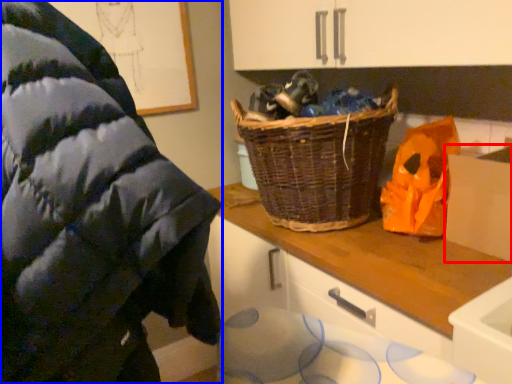
Question: Which object appears closest to the camera in this image, cardboard box (highlighted by a red box) or wool (highlighted by a blue box)?

Choices:
 (A) cardboard box
 (B) wool

Answer: (B)